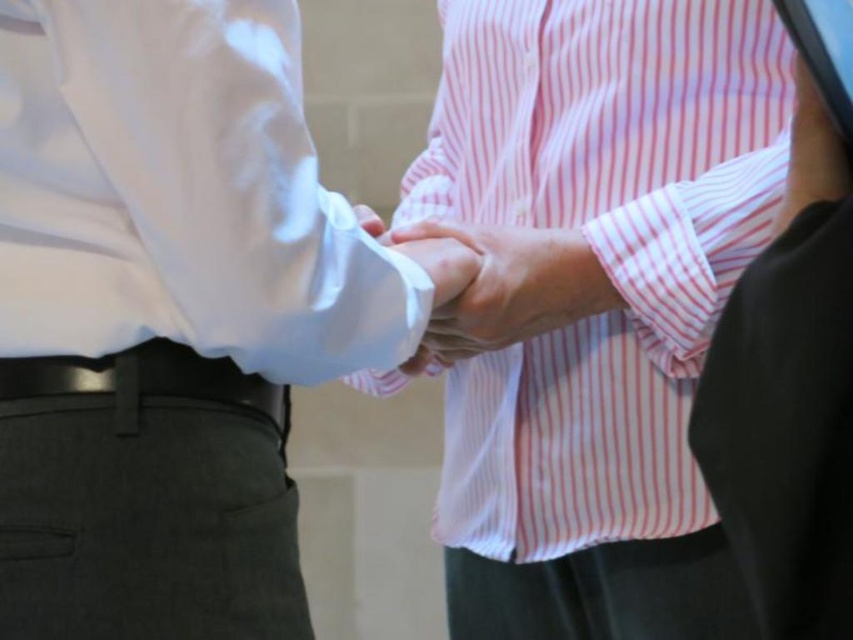
Does white smooth shirt at center appear over black leather belt at lower left?

Yes.

Does white smooth shirt at center have a smaller size compared to black leather belt at lower left?

No.

Is point (322, 268) more distant than point (141, 353)?

No, it is not.

Locate an element on the screen. white smooth shirt at center is located at coordinates (181, 195).

Does pink striped shirt at center come behind black leather belt at lower left?

Yes, pink striped shirt at center is further from the viewer.

Is pink striped shirt at center to the right of black leather belt at lower left from the viewer's perspective?

Indeed, pink striped shirt at center is positioned on the right side of black leather belt at lower left.

Image resolution: width=853 pixels, height=640 pixels. Describe the element at coordinates (599, 248) in the screenshot. I see `pink striped shirt at center` at that location.

The image size is (853, 640). What are the coordinates of `pink striped shirt at center` in the screenshot? It's located at (599, 248).

Is pink striped shirt at center wider than white smooth shirt at center?

Yes, pink striped shirt at center is wider than white smooth shirt at center.

Between pink striped shirt at center and white smooth shirt at center, which one has less height?

white smooth shirt at center

Which is behind, point (660, 216) or point (317, 298)?

Positioned behind is point (660, 216).

Image resolution: width=853 pixels, height=640 pixels. In order to click on pink striped shirt at center in this screenshot , I will do `click(599, 248)`.